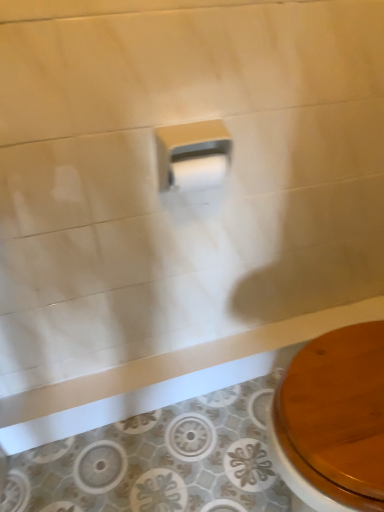
Question: Which direction should I rotate to look at white glossy toilet paper at center, which ranks as the 2th toilet paper in top-to-bottom order, — up or down?

Choices:
 (A) down
 (B) up

Answer: (B)

Question: Is white glossy toilet paper at center, which ranks as the 2th toilet paper in top-to-bottom order, to the left of white matte toilet paper at center, which ranks as the first toilet paper in top-to-bottom order, from the viewer's perspective?

Choices:
 (A) yes
 (B) no

Answer: (B)

Question: Can you confirm if white glossy toilet paper at center, placed as the first toilet paper when sorted from bottom to top, is positioned to the right of white matte toilet paper at center, which ranks as the first toilet paper in top-to-bottom order?

Choices:
 (A) yes
 (B) no

Answer: (A)

Question: Considering the relative sizes of white glossy toilet paper at center, which ranks as the 2th toilet paper in top-to-bottom order, and white matte toilet paper at center, which ranks as the first toilet paper in top-to-bottom order, in the image provided, is white glossy toilet paper at center, which ranks as the 2th toilet paper in top-to-bottom order, taller than white matte toilet paper at center, which ranks as the first toilet paper in top-to-bottom order,?

Choices:
 (A) no
 (B) yes

Answer: (A)

Question: Can you confirm if white glossy toilet paper at center, placed as the first toilet paper when sorted from bottom to top, is thinner than white matte toilet paper at center, which ranks as the first toilet paper in top-to-bottom order?

Choices:
 (A) yes
 (B) no

Answer: (A)

Question: Considering the relative sizes of white glossy toilet paper at center, placed as the first toilet paper when sorted from bottom to top, and white matte toilet paper at center, the second toilet paper in the bottom-to-top sequence, in the image provided, is white glossy toilet paper at center, placed as the first toilet paper when sorted from bottom to top, smaller than white matte toilet paper at center, the second toilet paper in the bottom-to-top sequence,?

Choices:
 (A) no
 (B) yes

Answer: (B)

Question: Is white glossy toilet paper at center, which ranks as the 2th toilet paper in top-to-bottom order, not inside white matte toilet paper at center, the second toilet paper in the bottom-to-top sequence?

Choices:
 (A) no
 (B) yes

Answer: (A)

Question: Is white matte toilet paper at center, the second toilet paper in the bottom-to-top sequence, taller than white glossy toilet paper at center, which ranks as the 2th toilet paper in top-to-bottom order?

Choices:
 (A) no
 (B) yes

Answer: (B)

Question: Is there a large distance between white matte toilet paper at center, which ranks as the first toilet paper in top-to-bottom order, and white glossy toilet paper at center, placed as the first toilet paper when sorted from bottom to top?

Choices:
 (A) no
 (B) yes

Answer: (A)

Question: Could you tell me if white matte toilet paper at center, which ranks as the first toilet paper in top-to-bottom order, is facing white glossy toilet paper at center, which ranks as the 2th toilet paper in top-to-bottom order?

Choices:
 (A) no
 (B) yes

Answer: (B)

Question: Is white glossy toilet paper at center, placed as the first toilet paper when sorted from bottom to top, at the back of white matte toilet paper at center, which ranks as the first toilet paper in top-to-bottom order?

Choices:
 (A) no
 (B) yes

Answer: (B)

Question: Is white matte toilet paper at center, the second toilet paper in the bottom-to-top sequence, at the right side of white glossy toilet paper at center, placed as the first toilet paper when sorted from bottom to top?

Choices:
 (A) yes
 (B) no

Answer: (B)

Question: From a real-world perspective, does white matte toilet paper at center, which ranks as the first toilet paper in top-to-bottom order, sit lower than white glossy toilet paper at center, which ranks as the 2th toilet paper in top-to-bottom order?

Choices:
 (A) yes
 (B) no

Answer: (B)

Question: Considering the positions of white matte toilet paper at center, the second toilet paper in the bottom-to-top sequence, and white glossy toilet paper at center, placed as the first toilet paper when sorted from bottom to top, in the image, is white matte toilet paper at center, the second toilet paper in the bottom-to-top sequence, taller or shorter than white glossy toilet paper at center, placed as the first toilet paper when sorted from bottom to top,?

Choices:
 (A) tall
 (B) short

Answer: (A)